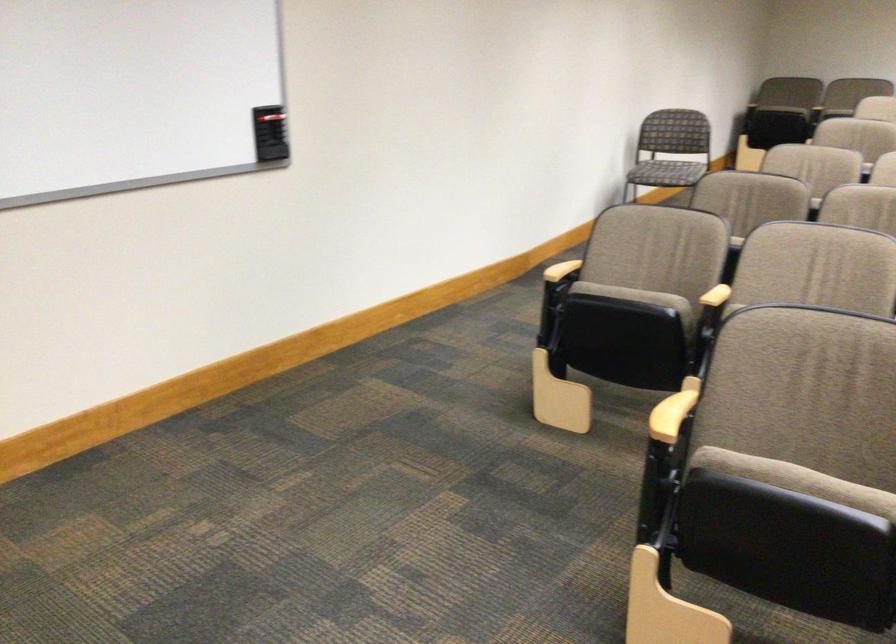
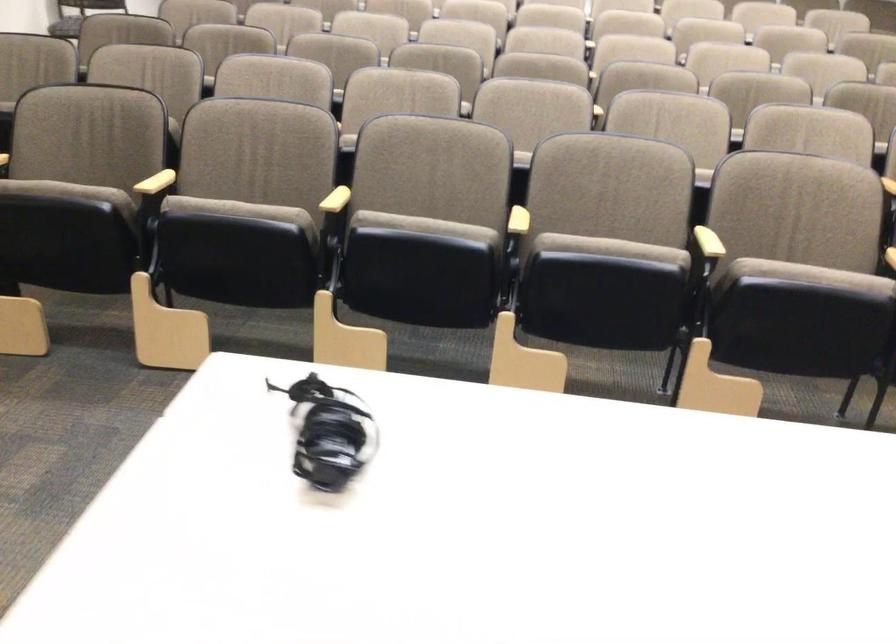
Find the pixel in the second image that matches the point at 774,498 in the first image.

(69, 192)